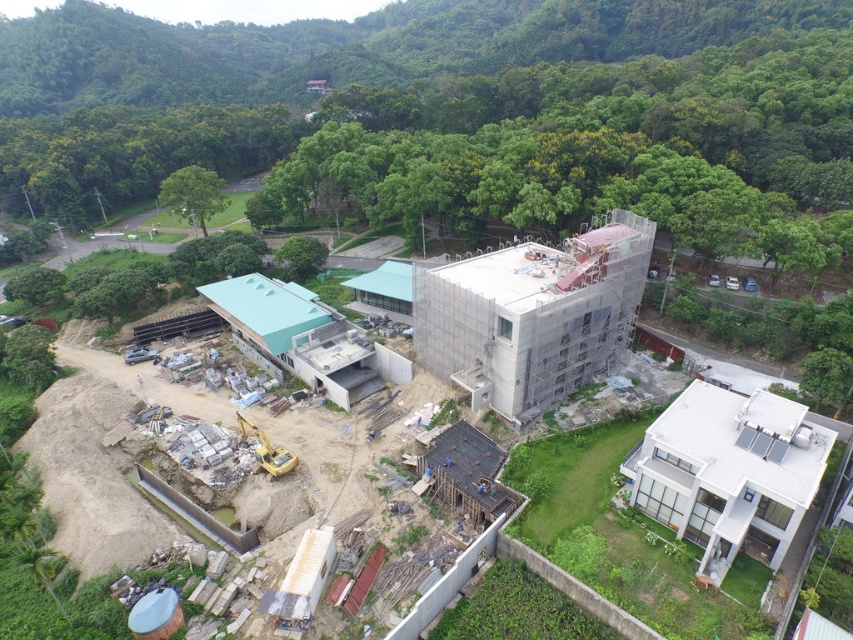
You are a construction worker who needs to move a heavy beam from the sandy concrete building at center to the scaffolding concrete building at center. Given that the beam is 20 feet long, will it fit between the two buildings without bending?

The distance between the sandy concrete building at center and the scaffolding concrete building at center is 21.95 feet. Since the beam is 20 feet long, it will fit between them without bending as there is enough space.

You are a construction inspector reviewing the site layout. You need to determine which building is shorter between the sandy concrete building at center and the scaffolding concrete building at center. Which one is it?

The sandy concrete building at center is shorter than the scaffolding concrete building at center.